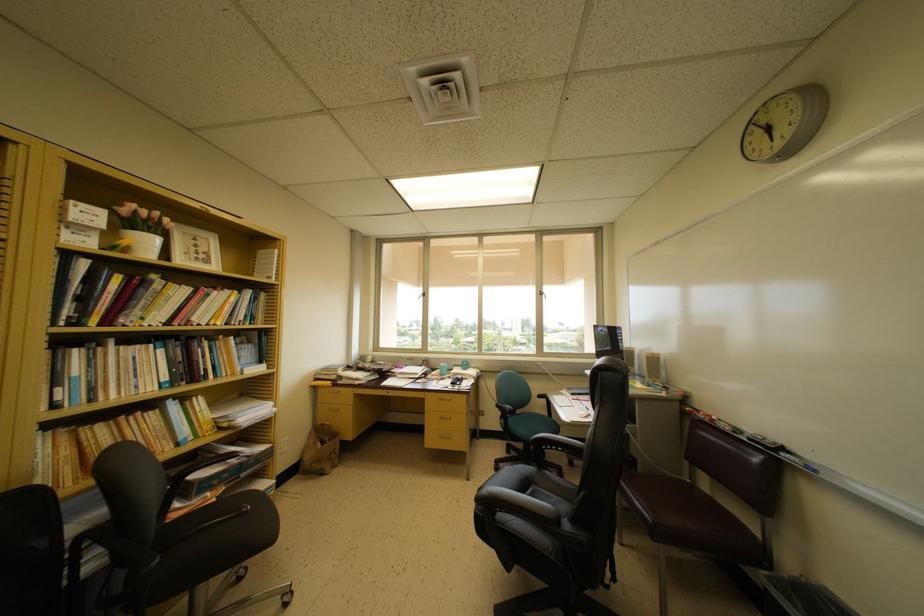
Describe the element at coordinates (445, 398) in the screenshot. This screenshot has width=924, height=616. I see `a desk drawer handle` at that location.